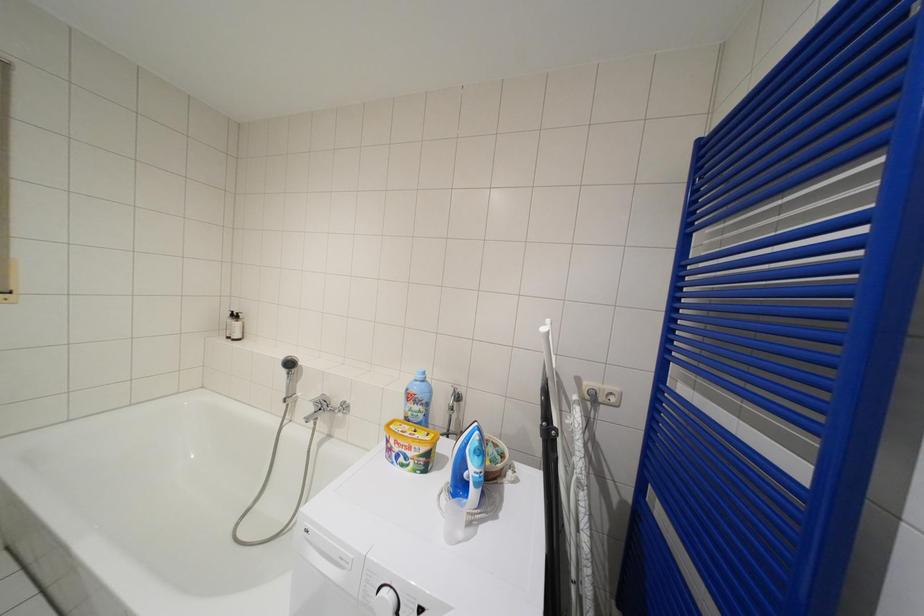
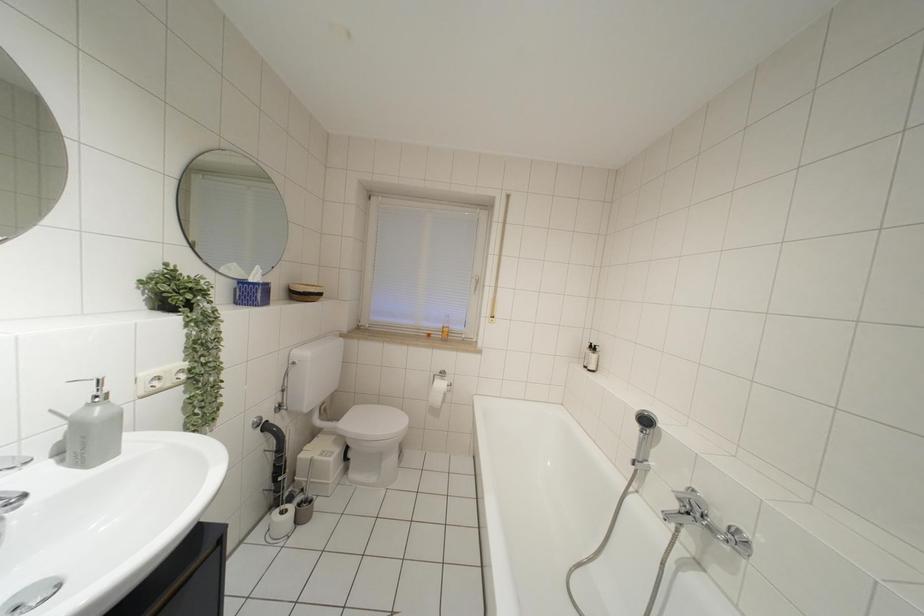
Question: The camera is either moving clockwise (left) or counter-clockwise (right) around the object. The first image is from the beginning of the video and the second image is from the end. Is the camera moving left or right when shooting the video?

Choices:
 (A) Left
 (B) Right

Answer: (B)